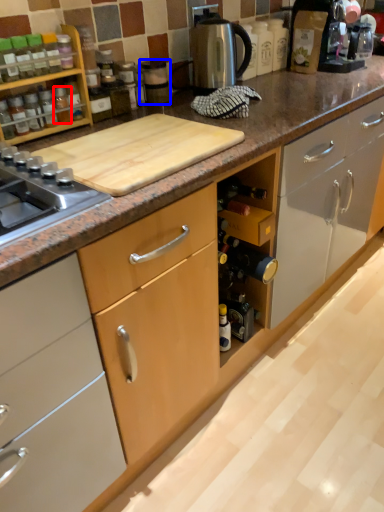
Question: Which point is closer to the camera, bottle (highlighted by a red box) or appliance (highlighted by a blue box)?

Choices:
 (A) bottle
 (B) appliance

Answer: (A)